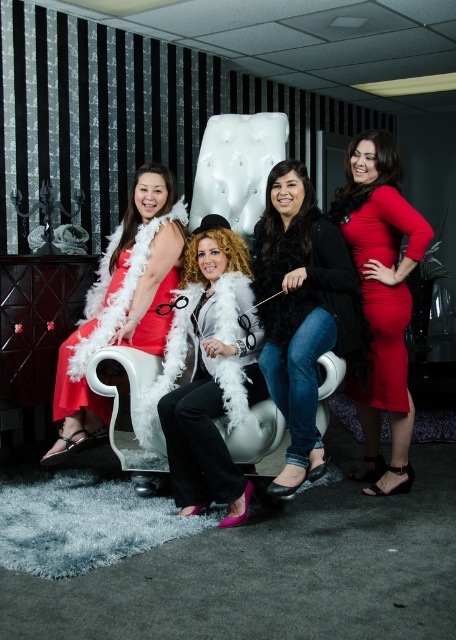
You are a fashion designer observing the image. You need to decide which garment is shorter between the black fur coat at center and the matte red dress at right. Which one is shorter?

The black fur coat at center is shorter than the matte red dress at right.

You are a photographer setting up a shoot in this room. You need to position a small light source to the left of the matte red dress at right and above the matte white feather boa at center. Is this possible given their positions?

The matte red dress at right is above the matte white feather boa at center, so placing the light to the left of the matte red dress at right and above the matte white feather boa at center is possible since the dress is already positioned above the boa.